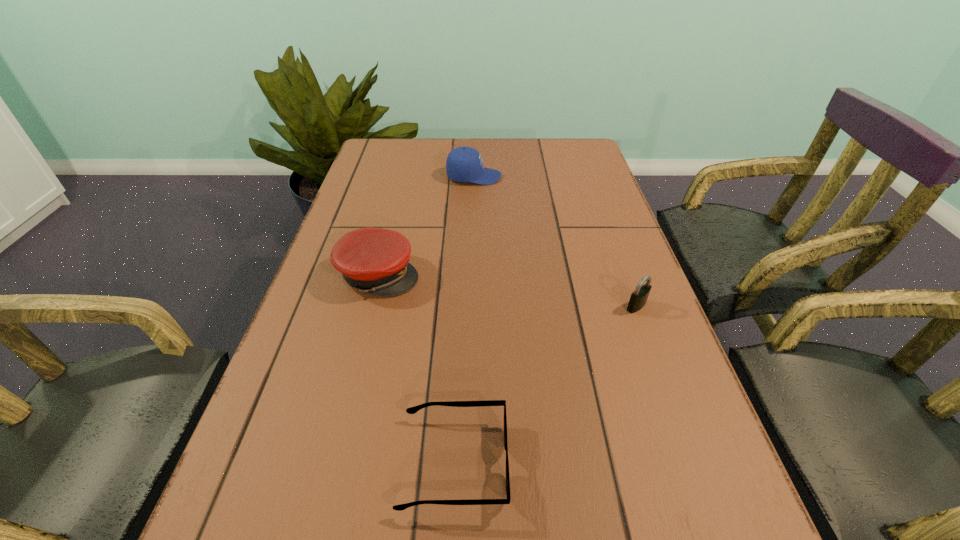
Identify the location of vacant space located on the arms of the nearest object. Image resolution: width=960 pixels, height=540 pixels. (539, 463).

Identify the location of object at the far edge. The image size is (960, 540). (464, 164).

This screenshot has width=960, height=540. Identify the location of object that is at the left edge. (375, 260).

You are a GUI agent. You are given a task and a screenshot of the screen. Output one action in this format:
    pyautogui.click(x=<x>, y=<y>)
    Task: Click on the object located in the right edge section of the desktop
    This screenshot has width=960, height=540.
    Given the screenshot: What is the action you would take?
    pyautogui.click(x=638, y=299)

This screenshot has width=960, height=540. In the image, there is a desktop. Identify the location of vacant space at the far edge. (528, 149).

Where is `vacant space at the left edge of the desktop`? vacant space at the left edge of the desktop is located at coordinates (328, 246).

At what (x,y) coordinates should I click in order to perform the action: click on free space at the right edge. Please return your answer as a coordinate pair (x, y). The image size is (960, 540). Looking at the image, I should click on (605, 343).

In the image, there is a desktop. Identify the location of vacant space at the far left corner. (415, 152).

The image size is (960, 540). Find the location of `vacant space at the far right corner of the desktop`. vacant space at the far right corner of the desktop is located at coordinates (586, 164).

Identify the location of vacant point located between the shortest object and the left cap. (417, 369).